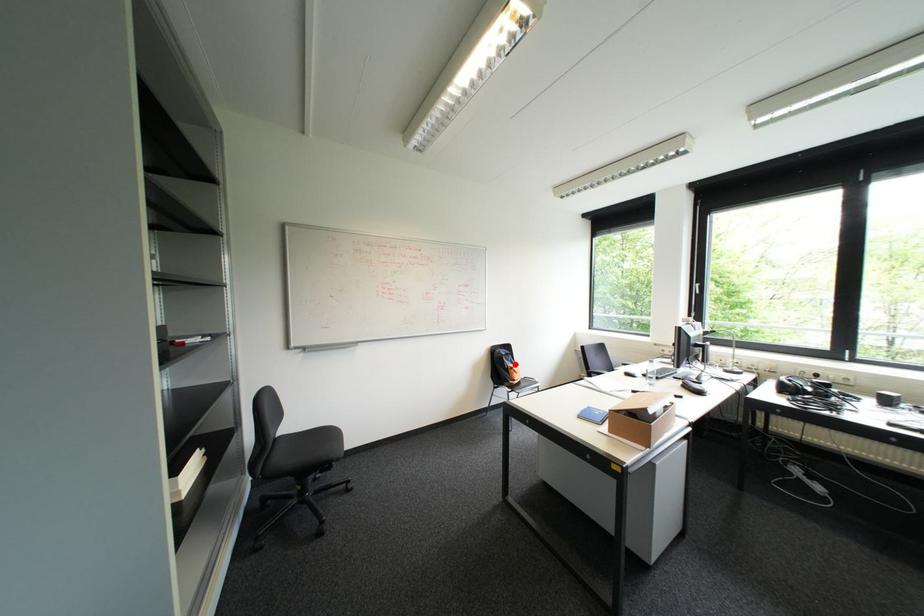
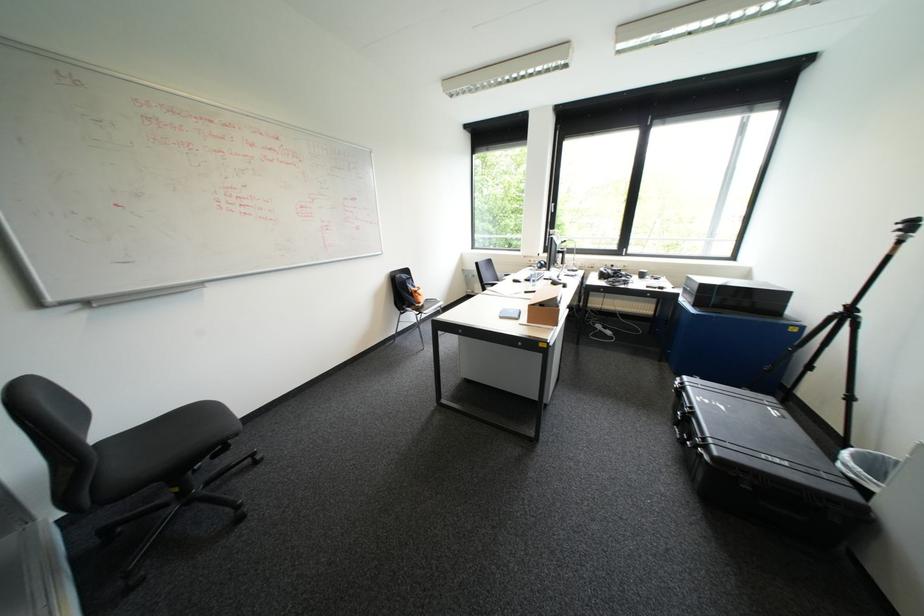
The point at the highlighted location is marked in the first image. Where is the corresponding point in the second image?

(419, 288)